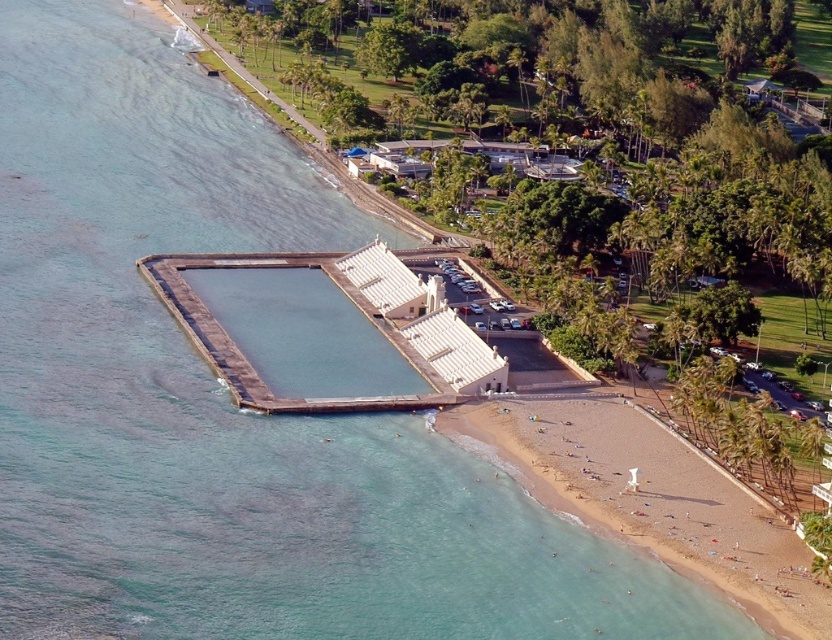
You are standing at the edge of the coastal area looking out towards the water. There are two points marked in the image. Which point, point (x=726, y=477) or point (x=437, y=390), is closer to you?

Point (x=726, y=477) is closer to you than point (x=437, y=390).

You are standing on the smooth concrete dock at lower center and want to walk to the beige sand beach at lower right. In which direction should you move?

You should move to the right to reach the beige sand beach at lower right from the smooth concrete dock at lower center since the beige sand beach at lower right is located to the right of the smooth concrete dock at lower center.